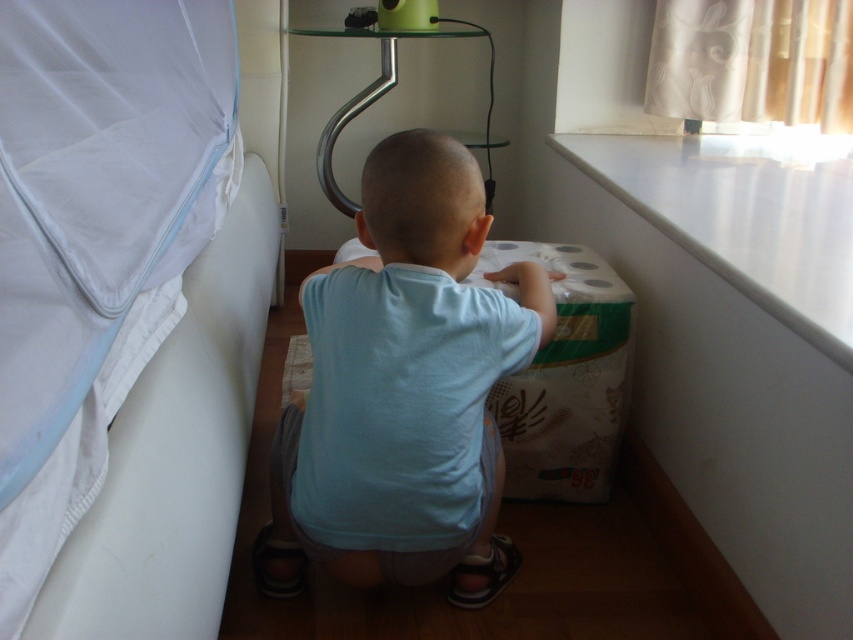
Question: Can you confirm if light blue cotton shirt at center is wider than white smooth ledge at upper right?

Choices:
 (A) no
 (B) yes

Answer: (A)

Question: Can you confirm if white fabric bed at left is thinner than white smooth ledge at upper right?

Choices:
 (A) no
 (B) yes

Answer: (B)

Question: Which point is closer to the camera taking this photo?

Choices:
 (A) click(447, 499)
 (B) click(80, 307)

Answer: (B)

Question: Among these points, which one is nearest to the camera?

Choices:
 (A) (463, 513)
 (B) (804, 152)
 (C) (155, 276)

Answer: (C)

Question: Can you confirm if white fabric bed at left is thinner than white smooth ledge at upper right?

Choices:
 (A) yes
 (B) no

Answer: (A)

Question: Among these points, which one is farthest from the camera?

Choices:
 (A) (701, 145)
 (B) (90, 106)

Answer: (A)